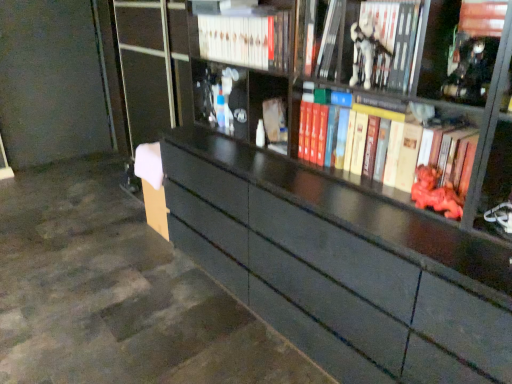
Question: In terms of width, does white matte figurine at upper center, marked as the 1th toy in a top-to-bottom arrangement, look wider or thinner when compared to white matte figurine at upper center, the 2th book from the right?

Choices:
 (A) wide
 (B) thin

Answer: (B)

Question: Is point (359, 18) positioned closer to the camera than point (392, 39)?

Choices:
 (A) farther
 (B) closer

Answer: (A)

Question: Which is farther from the matte white book at center?

Choices:
 (A) metallic silver statue at upper right
 (B) white matte figurine at upper center, the 2th book from the right
 (C) red matte book at upper right, the 1th book from the right
 (D) matte red statue at right, which is counted as the 1th toy, starting from the bottom
 (E) white glossy book at upper center, which appears as the first book when viewed from the left

Answer: (A)

Question: Estimate the real-world distances between objects in this image. Which object is farther from the white matte figurine at upper center, arranged as the 2th toy when viewed from the right?

Choices:
 (A) white glossy book at upper center, which appears as the first book when viewed from the left
 (B) matte white book at center
 (C) metallic silver statue at upper right
 (D) matte red statue at right, which is counted as the 1th toy, starting from the bottom
 (E) white matte figurine at upper center, the 2th book from the right

Answer: (B)